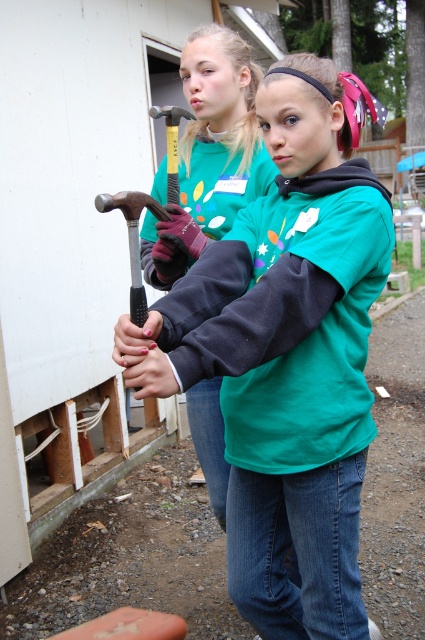
You are standing at point (184, 218) and want to walk to the building. Which direction should you go to avoid walking through the person at point (328, 355)?

Since point (328, 355) is in front of point (184, 218), you should walk to the left or right around them to reach the building without passing through.

From the picture: You are a construction worker needing to reach the matte black hammer at upper left while standing at the green matte sweatshirt at center. Can you comfortably reach it without moving your feet?

The distance between the green matte sweatshirt at center and the matte black hammer at upper left is 27.62 inches. Since the average comfortable reaching distance for an adult is about 24 inches, you might need to adjust your position slightly to reach it comfortably.

You are a construction worker who needs to reach the matte black hammer at upper left to continue working. The green matte sweatshirt at center is in your way. Can you move around it to access the hammer?

The green matte sweatshirt at center is taller than the matte black hammer at upper left, so you would need to move around it to access the hammer since it is blocking your path.